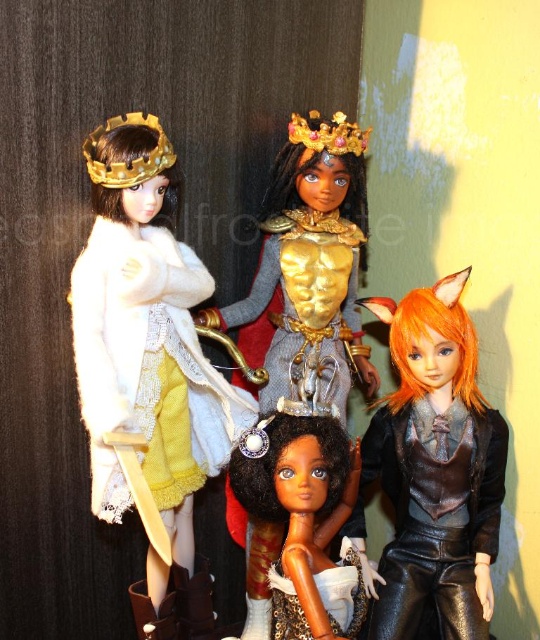
You are standing in front of the dolls and want to place a small decoration between the two points marked as point (x=168, y=412) and point (x=351, y=125). Which point should you place the decoration closer to so that it appears closer to you?

You should place the decoration closer to point (x=168, y=412) because it is in front of point (x=351, y=125), making it visually closer to you.

You are a fashion designer who wants to create a matching accessory for both the matte white coat at upper left and the shiny black leather jacket at lower right. Considering their sizes, which one would require a larger accessory to maintain proportion?

The matte white coat at upper left requires a larger accessory because it has a larger size compared to the shiny black leather jacket at lower right.